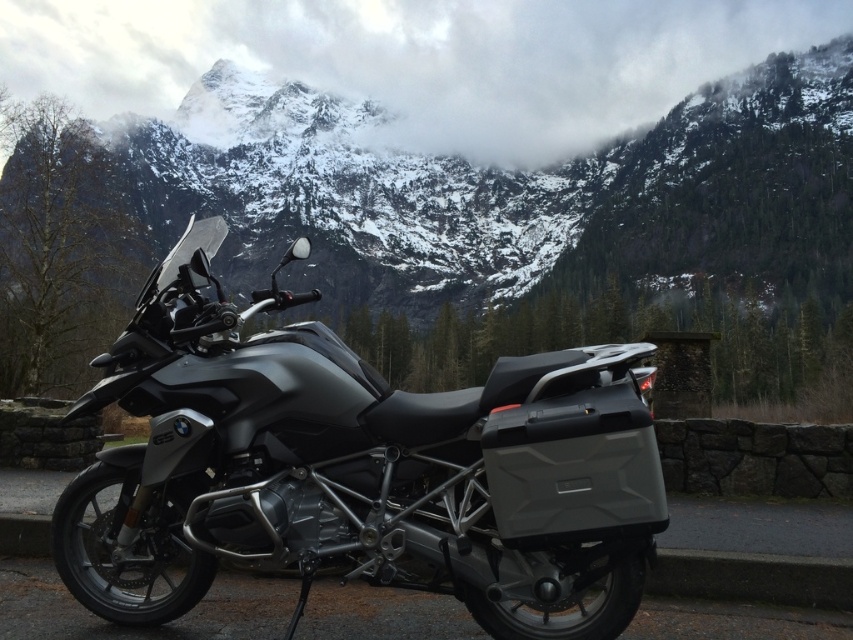
Between matte black motorcycle at center and black rubber curb at lower left, which one is positioned higher?

matte black motorcycle at center is higher up.

Which is more to the left, matte black motorcycle at center or black rubber curb at lower left?

From the viewer's perspective, matte black motorcycle at center appears more on the left side.

Is point (386, 515) farther from camera compared to point (769, 592)?

No, (386, 515) is in front of (769, 592).

Where is `matte black motorcycle at center`? Image resolution: width=853 pixels, height=640 pixels. matte black motorcycle at center is located at coordinates (358, 467).

Which of these two, snowy granite mountain at center or black rubber curb at lower left, stands shorter?

black rubber curb at lower left is shorter.

Is snowy granite mountain at center above black rubber curb at lower left?

Yes, snowy granite mountain at center is above black rubber curb at lower left.

The width and height of the screenshot is (853, 640). Describe the element at coordinates (508, 192) in the screenshot. I see `snowy granite mountain at center` at that location.

I want to click on snowy granite mountain at center, so click(x=508, y=192).

Does matte black motorcycle at center have a lesser height compared to snowy granite mountain at center?

Indeed, matte black motorcycle at center has a lesser height compared to snowy granite mountain at center.

Is matte black motorcycle at center closer to the viewer compared to snowy granite mountain at center?

Yes, matte black motorcycle at center is closer to the viewer.

Is point (245, 548) positioned before point (703, 225)?

Yes, it is.

Locate an element on the screen. The image size is (853, 640). matte black motorcycle at center is located at coordinates (358, 467).